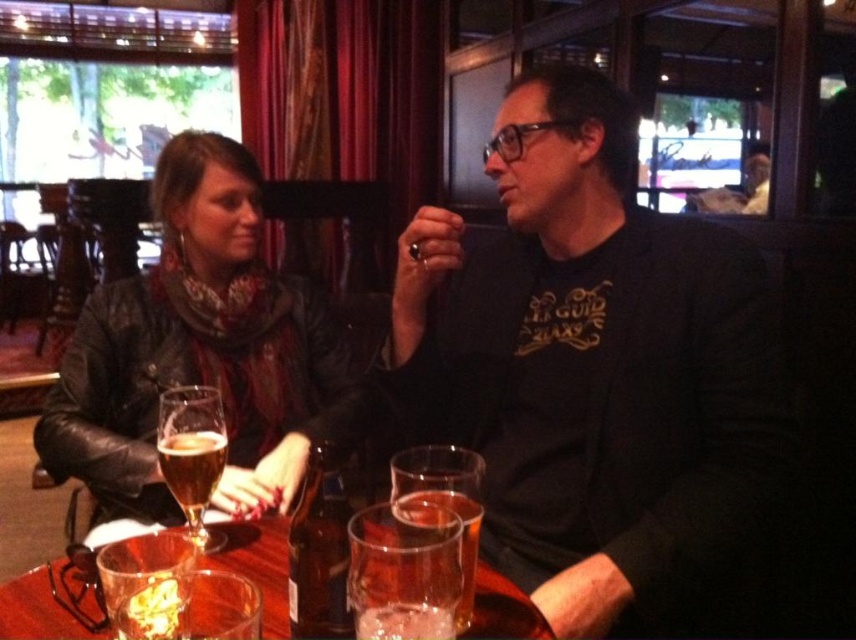
From the picture: You are a bartender who needs to place a new drink order. You see the leather jacket at left and the clear glass beer at center. Which object is taller?

The leather jacket at left is much taller than the clear glass beer at center.

Based on the photo, you are a bartender who needs to place a new drink order on the table between the clear glass wine glass at center and the translucent glass beer at center. Since the table is small, you want to ensure there is enough space. Which object should you move to make more room?

The clear glass wine glass at center occupies less space than the translucent glass beer at center, so moving the translucent glass beer at center would free up more space.